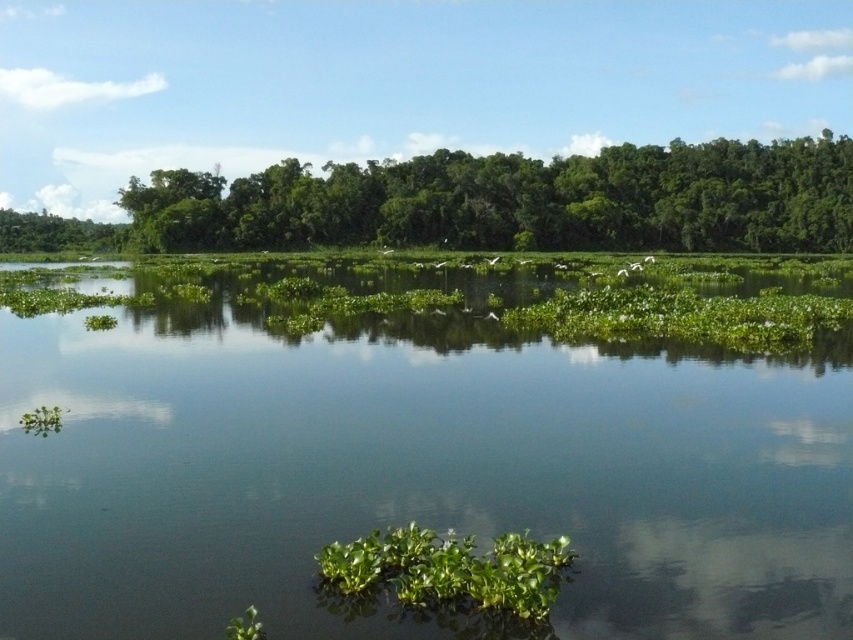
Is green leafy vegetation at center to the right of green leafy plant at center from the viewer's perspective?

Correct, you'll find green leafy vegetation at center to the right of green leafy plant at center.

What do you see at coordinates (415, 468) in the screenshot?
I see `green leafy vegetation at center` at bounding box center [415, 468].

Is point (672, 362) farther from viewer compared to point (409, 538)?

Yes, point (672, 362) is farther from viewer.

This screenshot has width=853, height=640. Identify the location of green leafy vegetation at center. (415, 468).

Is green leafy plant at center to the right of green leafy tree at upper left from the viewer's perspective?

Correct, you'll find green leafy plant at center to the right of green leafy tree at upper left.

Who is positioned more to the left, green leafy plant at center or green leafy tree at upper left?

Positioned to the left is green leafy tree at upper left.

Does point (453, 532) come in front of point (39, 216)?

Yes, it is.

You are a GUI agent. You are given a task and a screenshot of the screen. Output one action in this format:
    pyautogui.click(x=<x>, y=<y>)
    Task: Click on the green leafy plant at center
    
    Given the screenshot: What is the action you would take?
    pyautogui.click(x=450, y=570)

What do you see at coordinates (517, 202) in the screenshot?
I see `green leafy trees at upper center` at bounding box center [517, 202].

Does green leafy trees at upper center have a lesser width compared to green leafy plant at center?

No.

Who is more forward, (811, 189) or (500, 557)?

Point (500, 557) is in front.

The width and height of the screenshot is (853, 640). What are the coordinates of `green leafy trees at upper center` in the screenshot? It's located at (517, 202).